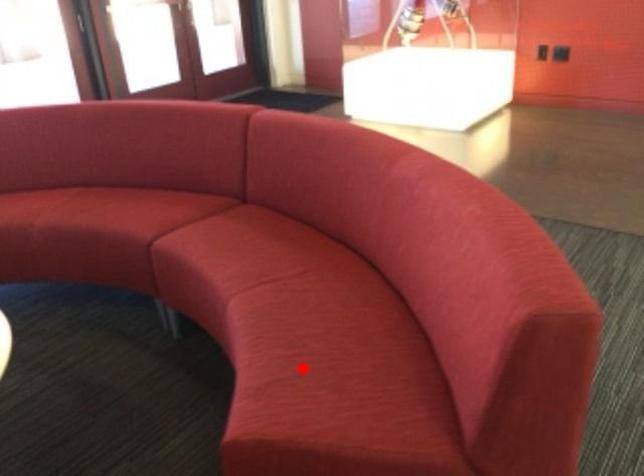
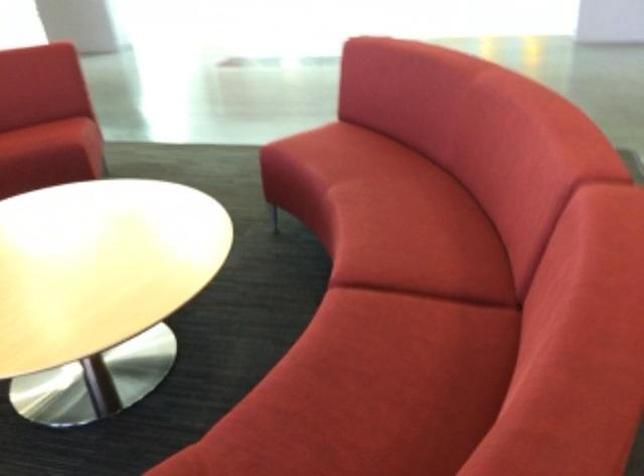
Find the pixel in the second image that matches the highlighted location in the first image.

(46, 136)